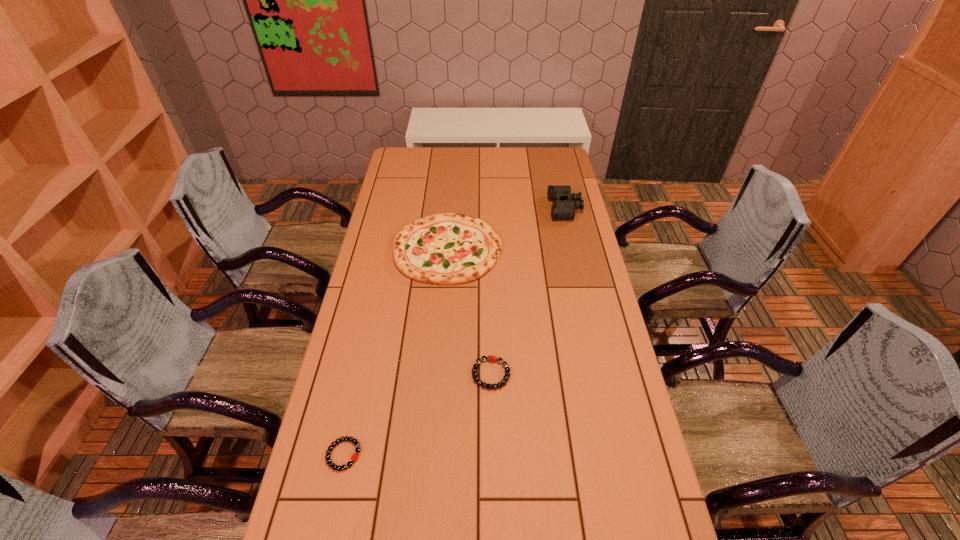
At what (x,y) coordinates should I click in order to perform the action: click on free space located 0.240m on the front of the third shortest object. Please return your answer as a coordinate pair (x, y). The width and height of the screenshot is (960, 540). Looking at the image, I should click on (441, 340).

The height and width of the screenshot is (540, 960). In order to click on free space located 0.360m on the back of the second shortest object in this screenshot , I will do `click(489, 275)`.

Find the location of `free space located on the right of the nearest object`. free space located on the right of the nearest object is located at coordinates (384, 455).

You are a GUI agent. You are given a task and a screenshot of the screen. Output one action in this format:
    pyautogui.click(x=<x>, y=<y>)
    Task: Click on the pizza at the left edge
    
    Given the screenshot: What is the action you would take?
    pyautogui.click(x=449, y=248)

Identify the location of bracelet located in the left edge section of the desktop. (354, 458).

Where is `object that is positioned at the right edge`? The image size is (960, 540). object that is positioned at the right edge is located at coordinates (565, 203).

What are the coordinates of `vacant space at the far edge` in the screenshot? It's located at (494, 168).

Where is `blank space at the left edge`? This screenshot has width=960, height=540. blank space at the left edge is located at coordinates (327, 538).

Image resolution: width=960 pixels, height=540 pixels. In the image, there is a desktop. In order to click on vacant area at the right edge in this screenshot , I will do `click(579, 279)`.

You are a GUI agent. You are given a task and a screenshot of the screen. Output one action in this format:
    pyautogui.click(x=<x>, y=<y>)
    Task: Click on the free region at the far left corner
    Image resolution: width=960 pixels, height=540 pixels.
    Given the screenshot: What is the action you would take?
    pyautogui.click(x=404, y=171)